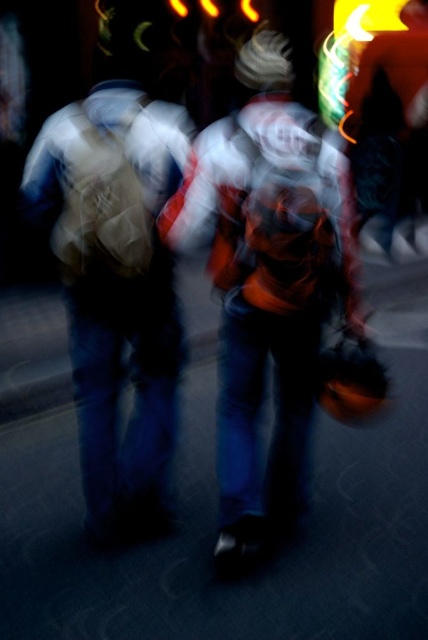
You are a photographer trying to adjust your camera settings to capture a clearer image of the orange fabric jacket at center and the matte brown backpack at left. Based on their positions, which object should you focus on first if you want to ensure both are in focus?

The orange fabric jacket at center is located below the matte brown backpack at left. To ensure both are in focus, you should focus on the matte brown backpack at left first since it is closer to the camera, allowing the jacket behind it to fall within the depth of field.

You are a security camera operator reviewing footage. You notice a point at coordinates (267,276) in the image. What object is located at this point?

The orange fabric jacket at center is located at point (267,276).

You are standing at the origin point in the image. Which of the two points, point (321, 124) or point (136, 440), is closer to you?

Point (136, 440) is closer to you because it is in front of point (321, 124) according to their positions.